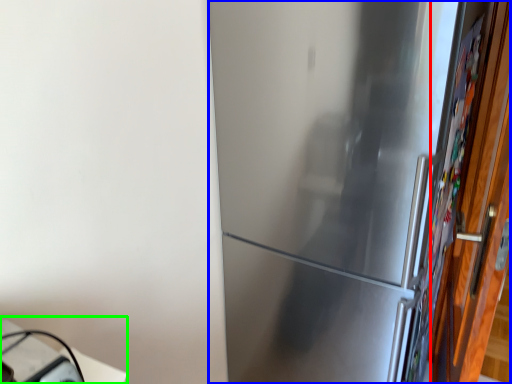
Question: Based on their relative distances, which object is nearer to door (highlighted by a red box)? Choose from refrigerator (highlighted by a blue box) and table (highlighted by a green box).

Choices:
 (A) refrigerator
 (B) table

Answer: (A)